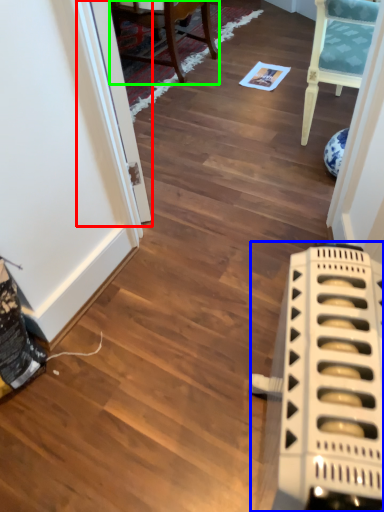
Question: Which object is positioned farthest from glass door (highlighted by a red box)? Select from appliance (highlighted by a blue box) and chair (highlighted by a green box).

Choices:
 (A) appliance
 (B) chair

Answer: (B)